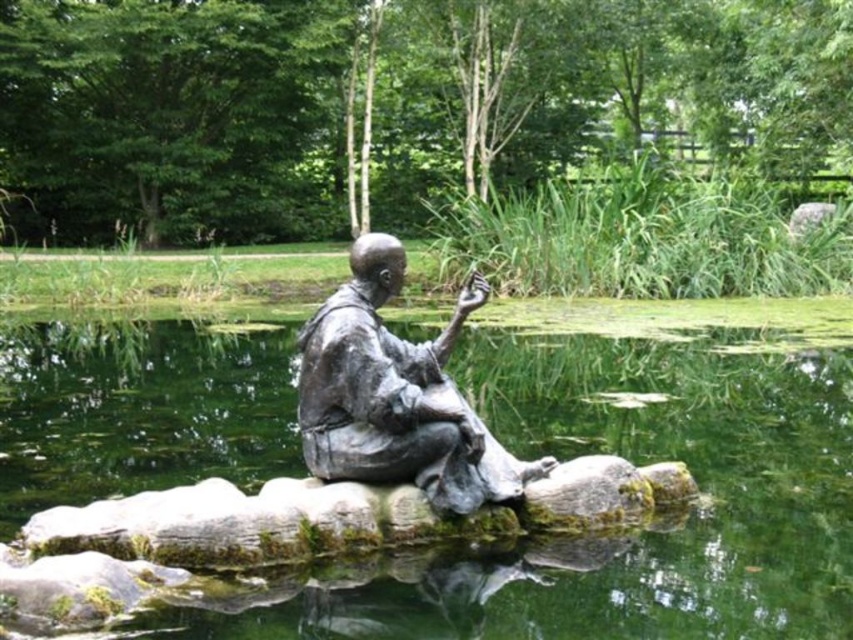
Question: Which object appears closest to the camera in this image?

Choices:
 (A) bronze statue at center
 (B) green mossy rock at center

Answer: (B)

Question: Does green mossy rock at center appear under bronze statue at center?

Choices:
 (A) no
 (B) yes

Answer: (A)

Question: Which point is closer to the camera?

Choices:
 (A) bronze statue at center
 (B) green mossy rock at center

Answer: (B)

Question: Which of the following is the closest to the observer?

Choices:
 (A) (418, 429)
 (B) (209, 337)

Answer: (A)

Question: Where is green mossy rock at center located in relation to bronze statue at center in the image?

Choices:
 (A) right
 (B) left

Answer: (A)

Question: Does green mossy rock at center appear under bronze statue at center?

Choices:
 (A) yes
 (B) no

Answer: (B)